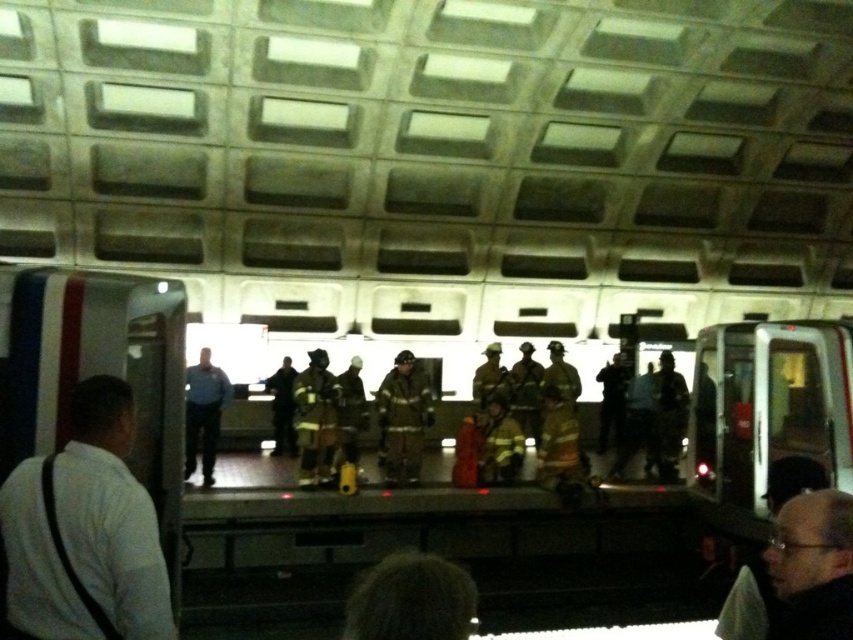
Question: Which of these objects is positioned closest to the reflective silver helmet at center?

Choices:
 (A) dark gray uniform at center
 (B) metallic silver train at right

Answer: (A)

Question: Which point is farther to the camera?

Choices:
 (A) (108, 444)
 (B) (193, 422)

Answer: (B)

Question: Can you confirm if white shirt at left is wider than blue uniform at center?

Choices:
 (A) yes
 (B) no

Answer: (A)

Question: Does reflective silver helmet at center come behind dark fabric uniform at center?

Choices:
 (A) yes
 (B) no

Answer: (B)

Question: Which object is the farthest from the white shirt at left?

Choices:
 (A) metallic silver train at right
 (B) reflective silver helmet at center

Answer: (B)

Question: Does white shirt at left appear on the left side of dark fabric uniform at center?

Choices:
 (A) yes
 (B) no

Answer: (B)